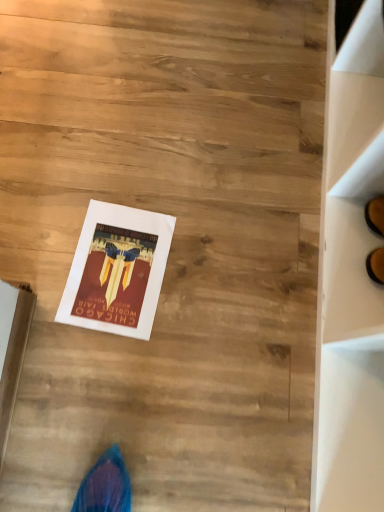
This screenshot has height=512, width=384. In order to click on free spot to the right of white cardboard box at lower left in this screenshot , I will do `click(91, 373)`.